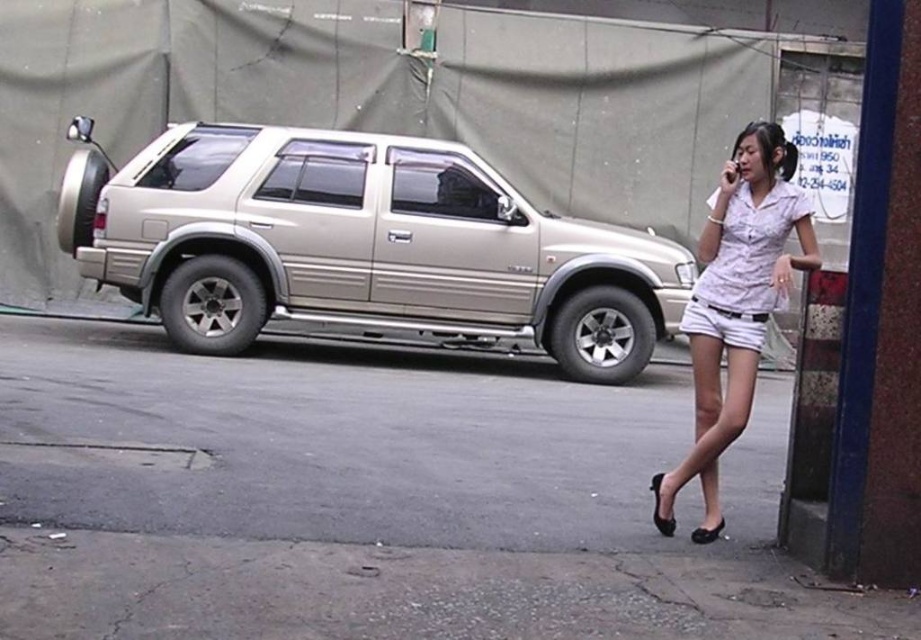
You are a pedestrian standing on the gray asphalt pavement at lower center. You want to walk towards the woman in white cotton shorts at center. Which direction should you move?

The gray asphalt pavement at lower center is to the right of white cotton shorts at center, so you should move to your left to reach the woman in white cotton shorts at center.

In the scene shown: You are a pedestrian standing on the sidewalk and see the metallic gold minivan at left and the white matte shorts at lower right. Which object is closer to your left side?

The metallic gold minivan at left is closer to your left side because it is positioned to the left of the white matte shorts at lower right.